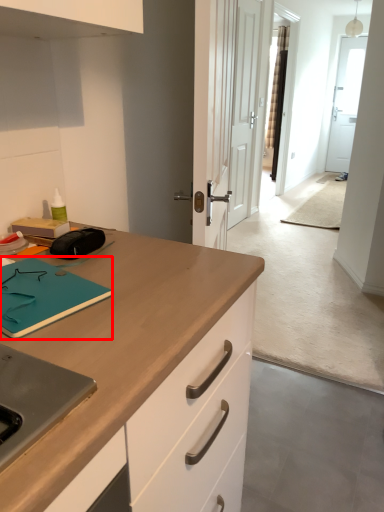
Question: From the image's perspective, where is notepad (annotated by the red box) located relative to door?

Choices:
 (A) below
 (B) above

Answer: (A)